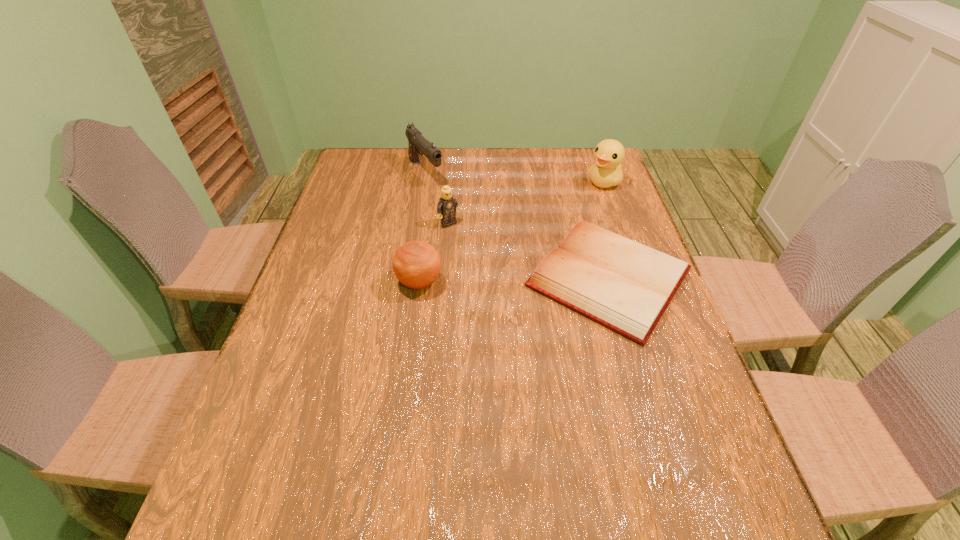
Identify the location of free space on the desktop that is between the orange and the Bible and is positioned in the direction the gun is aimed. (528, 280).

Find the location of a particular element. This screenshot has width=960, height=540. free space on the desktop that is between the orange and the Bible and is positioned in front of the Lego is located at coordinates (504, 280).

The image size is (960, 540). Find the location of `free space on the desktop that is between the orange and the shortest object and is positioned on the face of the duck`. free space on the desktop that is between the orange and the shortest object and is positioned on the face of the duck is located at coordinates (491, 280).